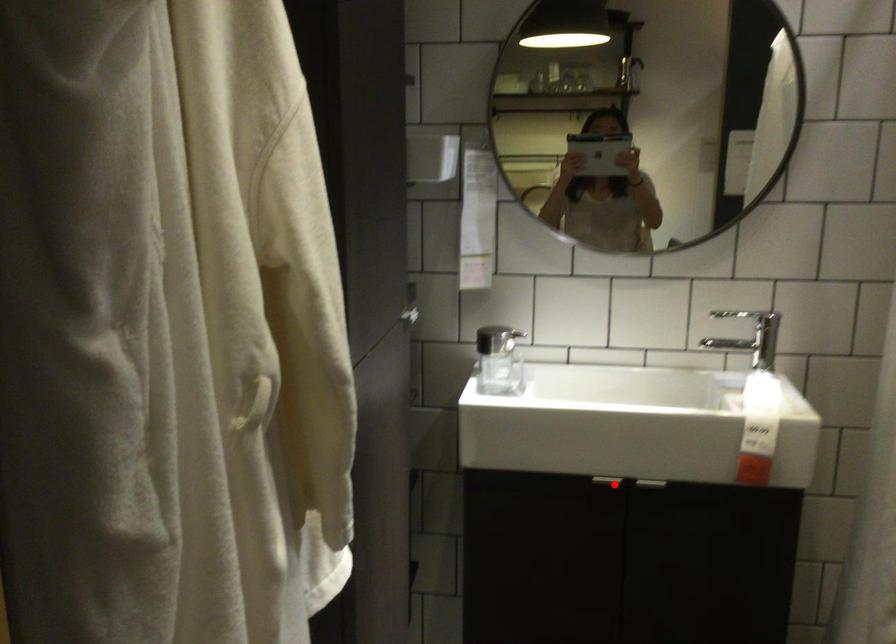
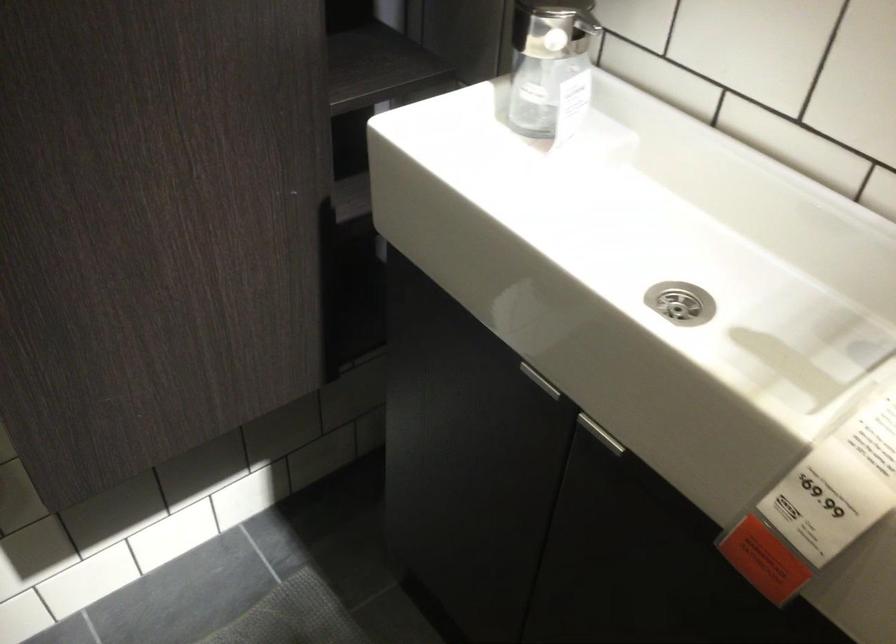
Question: I am providing you with two images of the same scene from different viewpoints. Image1 has a red point marked. In image2, the corresponding 3D location appears at what relative position? Reply with the corresponding letter.

Choices:
 (A) Closer
 (B) Farther

Answer: (A)